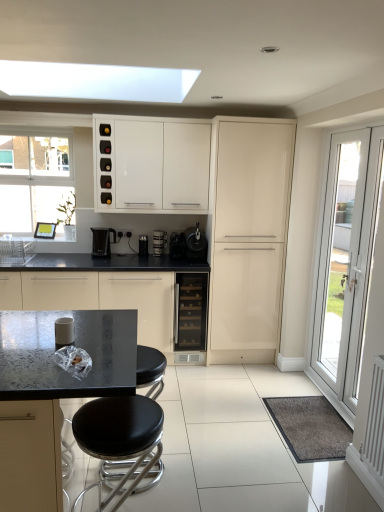
Question: Which direction should I rotate to face black plastic coffee machine at center, marked as the 3th coffee machine in a left-to-right arrangement, — up or down?

Choices:
 (A) up
 (B) down

Answer: (A)

Question: Is black plastic coffee machine at center, marked as the 3th coffee machine in a left-to-right arrangement, wider than satin black coffee machine at center, arranged as the 3th coffee machine when viewed from the right?

Choices:
 (A) yes
 (B) no

Answer: (A)

Question: Considering the relative positions of black plastic coffee machine at center, marked as the 3th coffee machine in a left-to-right arrangement, and satin black coffee machine at center, which ranks as the second coffee machine in left-to-right order, in the image provided, is black plastic coffee machine at center, marked as the 3th coffee machine in a left-to-right arrangement, to the left of satin black coffee machine at center, which ranks as the second coffee machine in left-to-right order, from the viewer's perspective?

Choices:
 (A) no
 (B) yes

Answer: (A)

Question: Is the surface of black plastic coffee machine at center, marked as the 3th coffee machine in a left-to-right arrangement, in direct contact with satin black coffee machine at center, which ranks as the second coffee machine in left-to-right order?

Choices:
 (A) no
 (B) yes

Answer: (A)

Question: From a real-world perspective, is black plastic coffee machine at center, marked as the 2th coffee machine in a right-to-left arrangement, beneath satin black coffee machine at center, arranged as the 3th coffee machine when viewed from the right?

Choices:
 (A) yes
 (B) no

Answer: (B)

Question: From the image's perspective, is black plastic coffee machine at center, marked as the 3th coffee machine in a left-to-right arrangement, below satin black coffee machine at center, which ranks as the second coffee machine in left-to-right order?

Choices:
 (A) yes
 (B) no

Answer: (A)

Question: Does black plastic coffee machine at center, marked as the 3th coffee machine in a left-to-right arrangement, come in front of satin black coffee machine at center, which ranks as the second coffee machine in left-to-right order?

Choices:
 (A) no
 (B) yes

Answer: (B)

Question: Is glossy cream cabinet at center, marked as the 3th cabinetry in a left-to-right arrangement, next to white glossy cabinet at upper center, which is the second cabinetry in left-to-right order, and touching it?

Choices:
 (A) no
 (B) yes

Answer: (A)

Question: From a real-world perspective, is glossy cream cabinet at center, marked as the 3th cabinetry in a left-to-right arrangement, physically above white glossy cabinet at upper center, which is the second cabinetry in left-to-right order?

Choices:
 (A) no
 (B) yes

Answer: (A)

Question: Are glossy cream cabinet at center, marked as the 3th cabinetry in a left-to-right arrangement, and white glossy cabinet at upper center, which is the second cabinetry in left-to-right order, far apart?

Choices:
 (A) no
 (B) yes

Answer: (A)

Question: Does glossy cream cabinet at center, marked as the 3th cabinetry in a left-to-right arrangement, have a lesser width compared to white glossy cabinet at upper center, marked as the second cabinetry in a right-to-left arrangement?

Choices:
 (A) no
 (B) yes

Answer: (A)

Question: Is glossy cream cabinet at center, marked as the 3th cabinetry in a left-to-right arrangement, at the right side of white glossy cabinet at upper center, marked as the second cabinetry in a right-to-left arrangement?

Choices:
 (A) no
 (B) yes

Answer: (B)

Question: Is glossy cream cabinet at center, the first cabinetry in the right-to-left sequence, facing away from white glossy cabinet at upper center, marked as the second cabinetry in a right-to-left arrangement?

Choices:
 (A) yes
 (B) no

Answer: (B)

Question: From a real-world perspective, is satin black coffee machine at center, which ranks as the second coffee machine in left-to-right order, below satin black coffee machine at center, acting as the 1th coffee machine starting from the right?

Choices:
 (A) yes
 (B) no

Answer: (A)